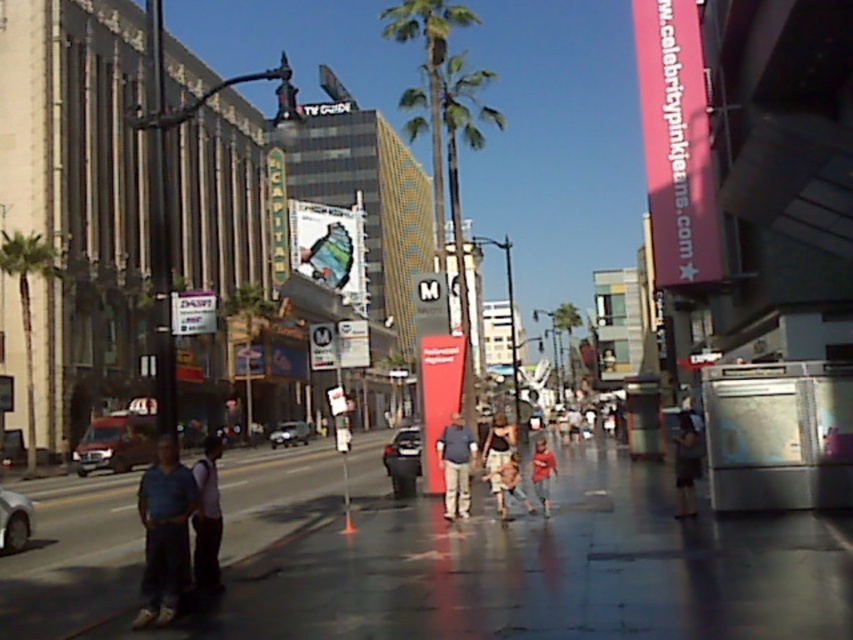
Can you confirm if green leafy palm tree at left is positioned below dark blue jeans at center?

No, green leafy palm tree at left is not below dark blue jeans at center.

Who is lower down, green leafy palm tree at left or dark blue jeans at center?

dark blue jeans at center

The width and height of the screenshot is (853, 640). In order to click on green leafy palm tree at left in this screenshot , I will do `click(27, 307)`.

Where is `green leafy palm tree at left`? green leafy palm tree at left is located at coordinates (27, 307).

Does metallic silver van at left appear on the left side of red cotton shirt at center?

Indeed, metallic silver van at left is positioned on the left side of red cotton shirt at center.

This screenshot has width=853, height=640. Find the location of `metallic silver van at left`. metallic silver van at left is located at coordinates (115, 442).

This screenshot has height=640, width=853. I want to click on silver metallic car at lower left, so click(x=15, y=520).

Which is in front, point (25, 504) or point (535, 461)?

Positioned in front is point (25, 504).

Where is `silver metallic car at lower left`? This screenshot has width=853, height=640. silver metallic car at lower left is located at coordinates (15, 520).